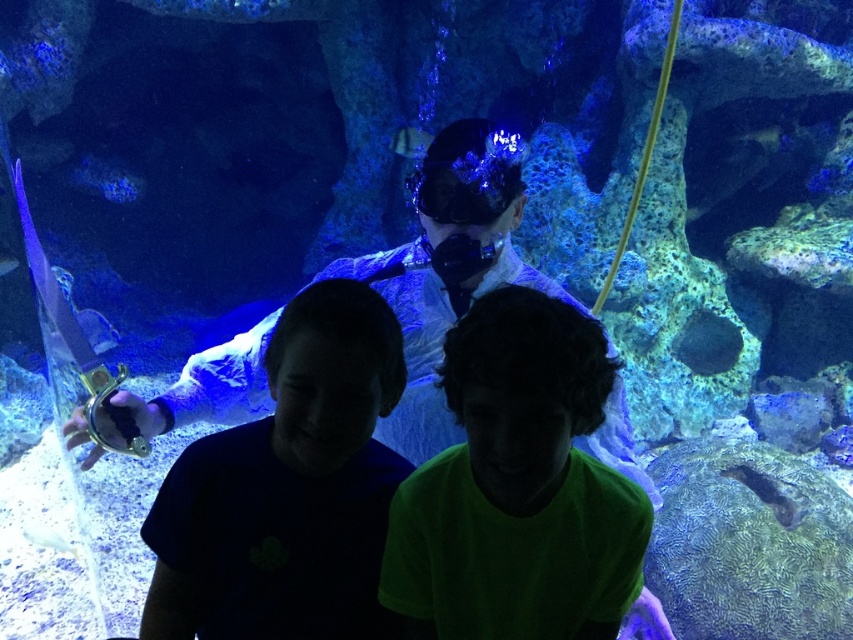
Which of these two, green matte shirt at center or white glossy fish at lower left, stands taller?

Standing taller between the two is green matte shirt at center.

Is green matte shirt at center positioned before white glossy fish at lower left?

Yes, green matte shirt at center is in front of white glossy fish at lower left.

Between point (581, 513) and point (74, 552), which one is positioned behind?

The point (74, 552) is behind.

Find the location of `green matte shirt at center`. green matte shirt at center is located at coordinates (517, 488).

Which is more to the left, matte white diver at center or white glossy fish at lower left?

white glossy fish at lower left

The height and width of the screenshot is (640, 853). Describe the element at coordinates (288, 488) in the screenshot. I see `matte white diver at center` at that location.

Where is `matte white diver at center`? The width and height of the screenshot is (853, 640). matte white diver at center is located at coordinates (288, 488).

Does green matte shirt at center lie behind translucent glass fish at upper center?

No.

Is green matte shirt at center wider than translucent glass fish at upper center?

Yes.

This screenshot has width=853, height=640. What are the coordinates of `green matte shirt at center` in the screenshot? It's located at (517, 488).

What are the coordinates of `green matte shirt at center` in the screenshot? It's located at (517, 488).